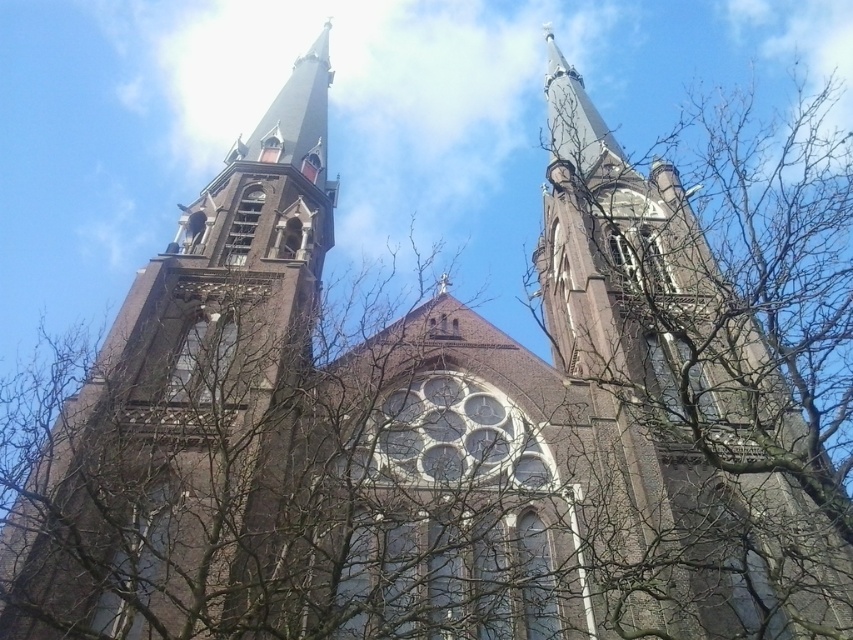
Question: Which point is closer to the camera taking this photo?

Choices:
 (A) (x=152, y=339)
 (B) (x=601, y=518)

Answer: (B)

Question: Can you confirm if brown brick tower at upper left is positioned to the left of brown brick tower at center?

Choices:
 (A) yes
 (B) no

Answer: (A)

Question: Which object appears farthest from the camera in this image?

Choices:
 (A) brown brick tower at upper left
 (B) brown brick tower at center

Answer: (B)

Question: Does brown brick tower at upper left have a lesser width compared to brown brick tower at center?

Choices:
 (A) no
 (B) yes

Answer: (B)

Question: Where is brown brick tower at upper left located in relation to brown brick tower at center in the image?

Choices:
 (A) right
 (B) left

Answer: (B)